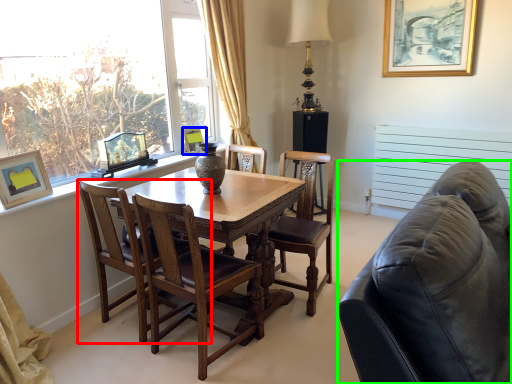
Question: Based on their relative distances, which object is farther from chair (highlighted by a red box)? Choose from picture frame (highlighted by a blue box) and studio couch (highlighted by a green box).

Choices:
 (A) picture frame
 (B) studio couch

Answer: (B)